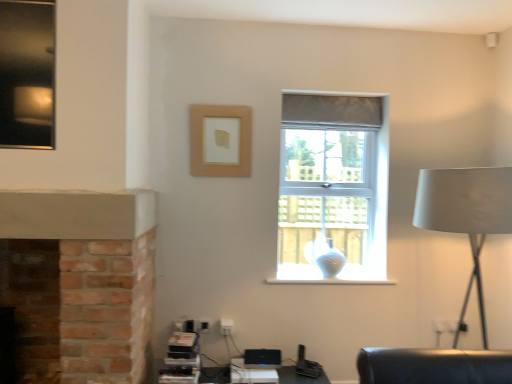
Question: Is translucent glass vase at window taller or shorter than white plastic table at lower center?

Choices:
 (A) tall
 (B) short

Answer: (A)

Question: Looking at their shapes, would you say translucent glass vase at window is wider or thinner than white plastic table at lower center?

Choices:
 (A) wide
 (B) thin

Answer: (B)

Question: Which object is positioned farthest from the translucent glass vase at window?

Choices:
 (A) white plastic table at lower center
 (B) white matte table lamp at right
 (C) beige matte picture frame at upper center
 (D) clear glass window at center

Answer: (D)

Question: Which is nearer to the clear glass window at center?

Choices:
 (A) white plastic table at lower center
 (B) beige matte picture frame at upper center
 (C) white matte table lamp at right
 (D) translucent glass vase at window

Answer: (D)